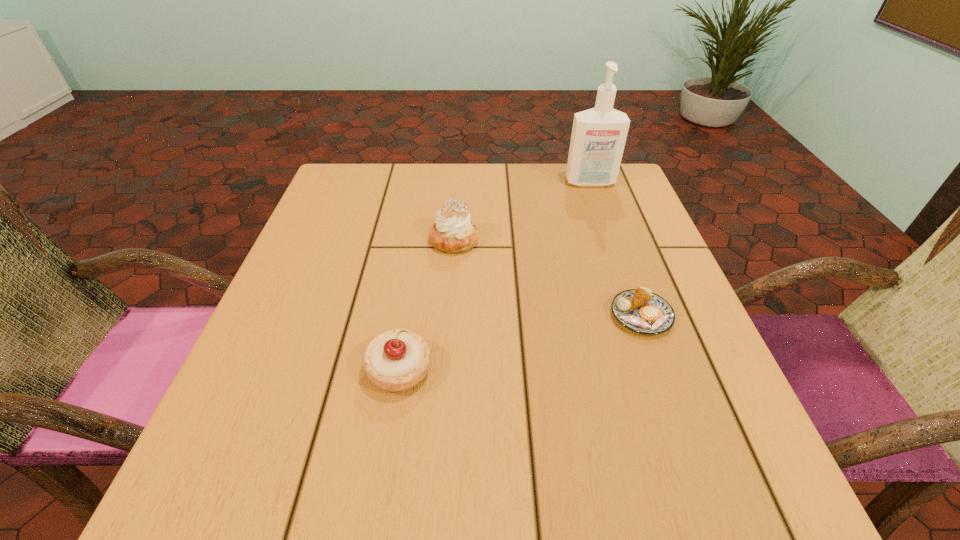
Where is `the farthest object`? The width and height of the screenshot is (960, 540). the farthest object is located at coordinates (598, 137).

The width and height of the screenshot is (960, 540). In order to click on cleansing agent in this screenshot , I will do `click(598, 137)`.

This screenshot has height=540, width=960. Identify the location of the third nearest object. (452, 232).

This screenshot has width=960, height=540. In order to click on the third shortest object in this screenshot , I will do `click(452, 232)`.

Where is `the nearest pastry`? the nearest pastry is located at coordinates (396, 360).

Locate an element on the screen. the second tallest pastry is located at coordinates (396, 360).

Image resolution: width=960 pixels, height=540 pixels. Find the location of `the second nearest pastry`. the second nearest pastry is located at coordinates (640, 310).

Image resolution: width=960 pixels, height=540 pixels. Identify the location of the shortest pastry. pos(640,310).

Locate an element on the screen. free space located 0.340m on the front label of the cleansing agent is located at coordinates (626, 286).

Where is `free spot located 0.200m on the right of the second farthest object`? This screenshot has height=540, width=960. free spot located 0.200m on the right of the second farthest object is located at coordinates (572, 240).